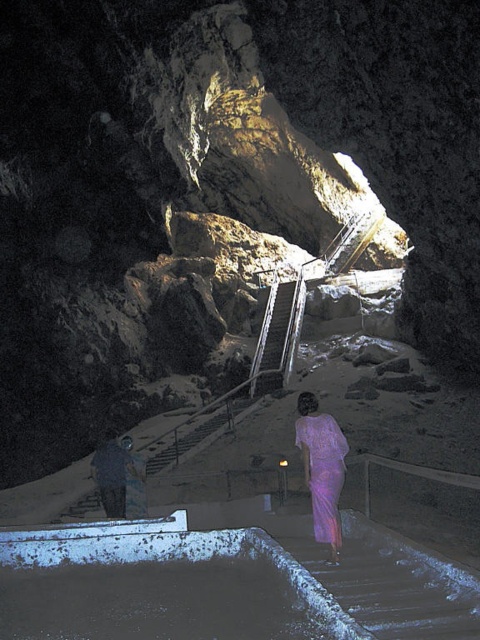
Question: Which point is closer to the camera?

Choices:
 (A) dark gray stone statue at lower left
 (B) purple silk dress at center

Answer: (B)

Question: Which point is farther to the camera?

Choices:
 (A) dark gray stone statue at lower left
 (B) purple silk dress at center

Answer: (A)

Question: Which point is closer to the camera?

Choices:
 (A) purple silk dress at center
 (B) dark gray stone statue at lower left

Answer: (A)

Question: Does purple silk dress at center have a greater width compared to dark gray stone statue at lower left?

Choices:
 (A) yes
 (B) no

Answer: (B)

Question: Is purple silk dress at center positioned at the back of dark gray stone statue at lower left?

Choices:
 (A) yes
 (B) no

Answer: (B)

Question: Considering the relative positions of purple silk dress at center and dark gray stone statue at lower left in the image provided, where is purple silk dress at center located with respect to dark gray stone statue at lower left?

Choices:
 (A) above
 (B) below

Answer: (A)